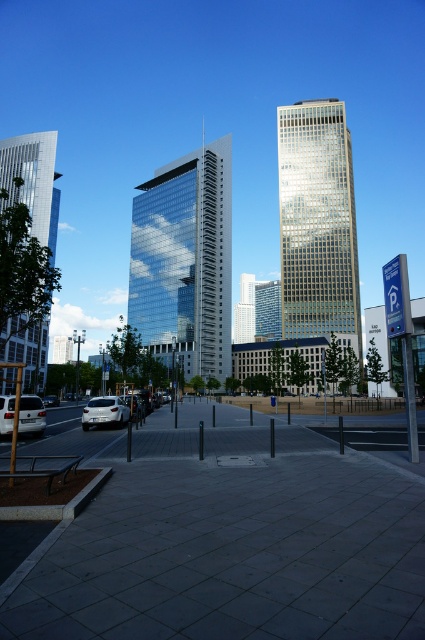
Question: Observing the image, what is the correct spatial positioning of gray concrete pavement at center in reference to matte silver van at lower left?

Choices:
 (A) left
 (B) right

Answer: (B)

Question: Which object is the farthest from the gold glass skyscraper at center?

Choices:
 (A) glassy reflective skyscraper at left
 (B) matte silver van at lower left

Answer: (B)

Question: Estimate the real-world distances between objects in this image. Which object is farther from the white glossy sedan at lower left?

Choices:
 (A) glassy reflective skyscraper at center
 (B) gray concrete pavement at center
 (C) matte silver van at lower left
 (D) gold glass skyscraper at center

Answer: (D)

Question: Is the position of gold glass skyscraper at center more distant than that of matte silver van at lower left?

Choices:
 (A) no
 (B) yes

Answer: (B)

Question: Which object appears closest to the camera in this image?

Choices:
 (A) gray concrete pavement at center
 (B) white glossy car at lower left
 (C) matte silver van at lower left
 (D) gold glass skyscraper at center

Answer: (A)

Question: Is gray concrete pavement at center further to the viewer compared to matte silver van at lower left?

Choices:
 (A) yes
 (B) no

Answer: (B)